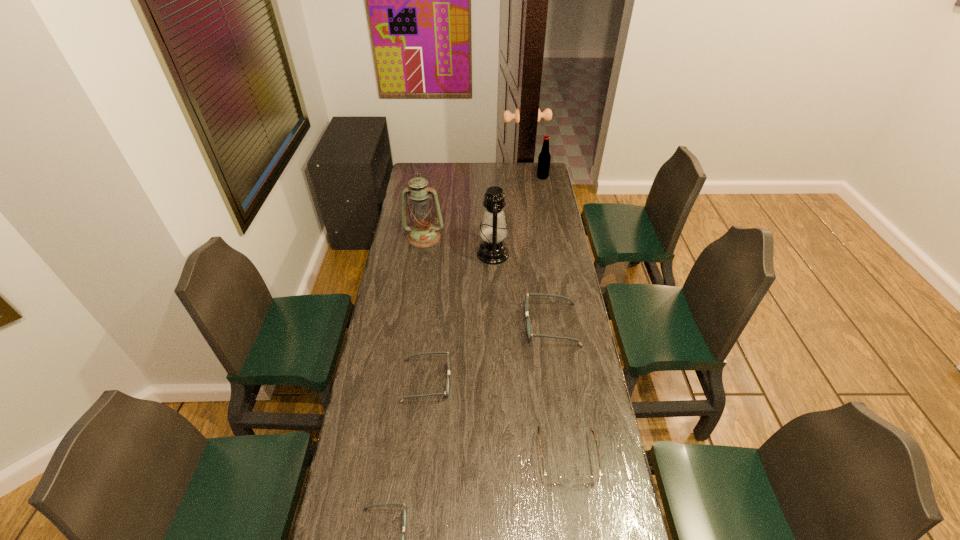
Locate an element on the screen. This screenshot has height=540, width=960. free region that satisfies the following two spatial constraints: 1. on the back side of the right oil lamp; 2. on the left side of the third tallest object is located at coordinates (491, 177).